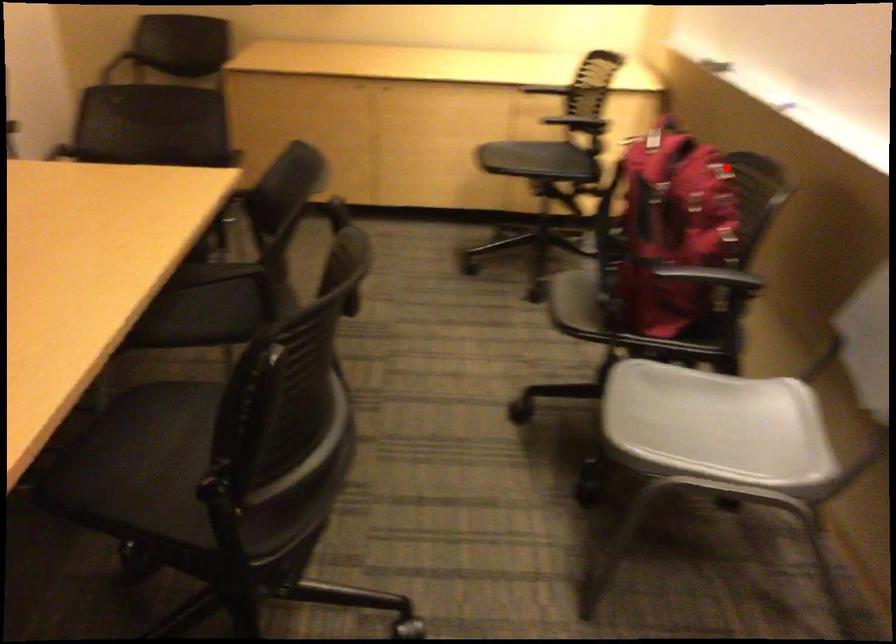
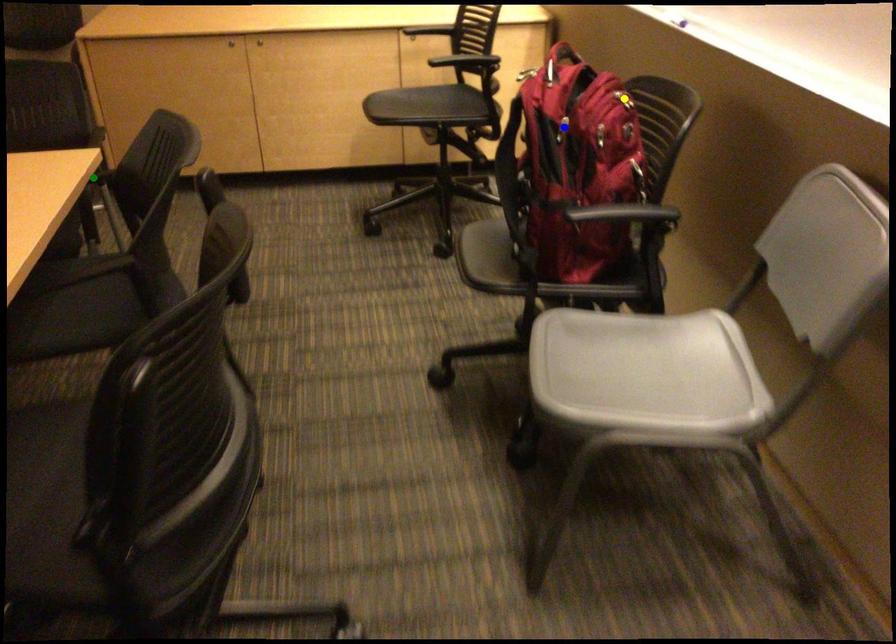
Question: I am providing you with two images of the same scene from different viewpoints. A red point is marked on the first image. You are given multiple points on the second image. Which point in image 2 represents the same 3d spot as the red point in image 1?

Choices:
 (A) yellow point
 (B) green point
 (C) blue point

Answer: (A)